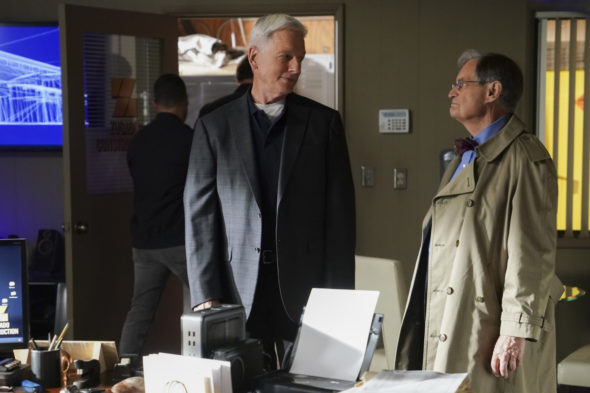
Where is `wall behind men`? wall behind men is located at coordinates (376, 68).